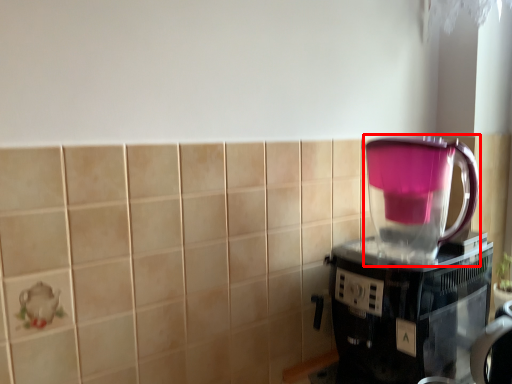
Question: From the image's perspective, what is the correct spatial positioning of blender (annotated by the red box) in reference to coffee maker?

Choices:
 (A) below
 (B) above

Answer: (B)